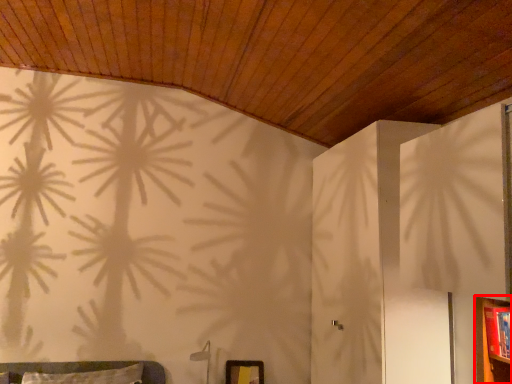
Question: Where is dresser (annotated by the red box) located in relation to picture frame in the image?

Choices:
 (A) right
 (B) left

Answer: (A)